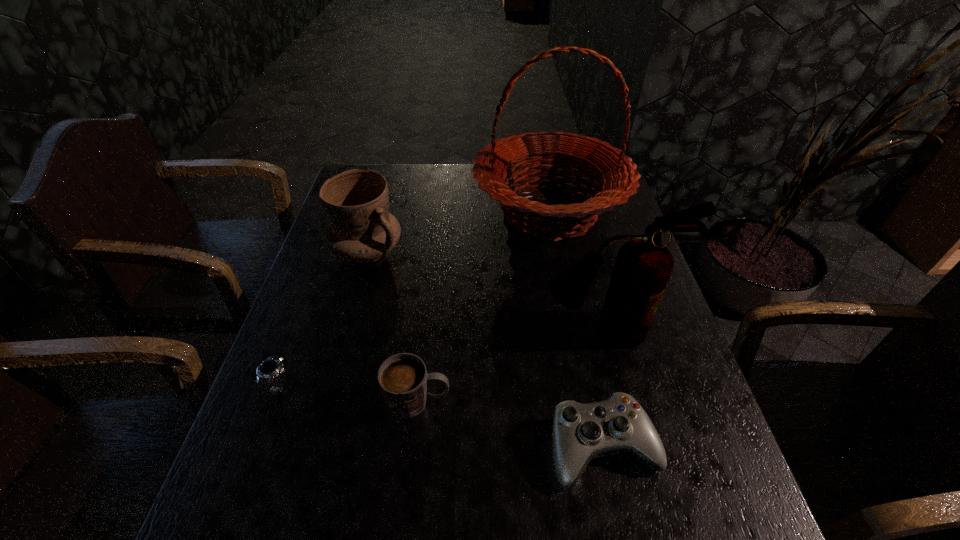
Find the location of a particular element. The height and width of the screenshot is (540, 960). free space between the shortest object and the second shortest object is located at coordinates (442, 416).

Locate an element on the screen. empty location between the pottery and the watch is located at coordinates (324, 319).

This screenshot has height=540, width=960. I want to click on free space between the fourth tallest object and the second shortest object, so click(511, 424).

Identify the location of blank region between the second tallest object and the fourth shortest object. The image size is (960, 540). (486, 291).

You are a GUI agent. You are given a task and a screenshot of the screen. Output one action in this format:
    pyautogui.click(x=<x>, y=<y>)
    Task: Click on the vacant region between the watch and the third tallest object
    The image size is (960, 540).
    Given the screenshot: What is the action you would take?
    pyautogui.click(x=324, y=319)

I want to click on vacant area that lies between the third farthest object and the third object from left to right, so click(x=511, y=366).

Locate an element on the screen. object that stands as the closest to the watch is located at coordinates click(x=403, y=379).

Identify which object is located as the fifth nearest to the pottery. Please provide its 2D coordinates. Your answer should be formatted as a tuple, i.e. [(x, y)], where the tuple contains the x and y coordinates of a point satisfying the conditions above.

[(581, 432)]

Where is `free space in the image that satisfies the following two spatial constraints: 1. on the front side of the watch; 2. on the left side of the control`? free space in the image that satisfies the following two spatial constraints: 1. on the front side of the watch; 2. on the left side of the control is located at coordinates (257, 447).

Identify the location of free space that satisfies the following two spatial constraints: 1. on the back side of the tallest object; 2. on the right side of the pottery. (378, 212).